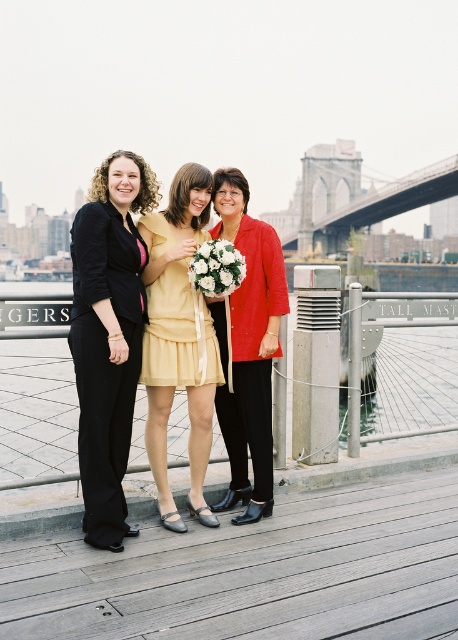
You are a photographer setting up a camera to capture the three women on the dock. You need to ensure that both the matte red blazer at center and the yellow satin dress at center are clearly visible in the frame. Given their sizes, which clothing item should you focus on first to ensure proper exposure?

The matte red blazer at center is bigger than the yellow satin dress at center, so you should focus on the matte red blazer at center first to ensure proper exposure since larger objects may require more precise focus and exposure adjustments to capture details effectively.

You are a photographer adjusting your camera settings to focus on the subjects in the scene. Which object, the matte yellow dress at center or the white silk bouquet at center, is positioned closer to the camera?

The matte yellow dress at center is closer to the viewer than the white silk bouquet at center, so the photographer should focus on the matte yellow dress at center to ensure it is in sharp focus.